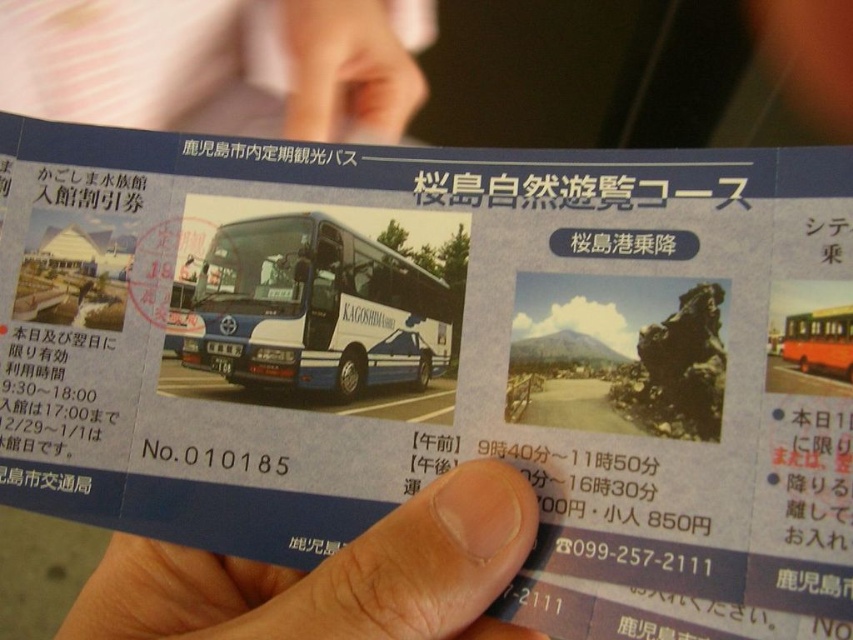
Question: Does blue glossy bus at center appear on the right side of orange matte bus at center?

Choices:
 (A) yes
 (B) no

Answer: (B)

Question: Which of the following is the farthest from the observer?

Choices:
 (A) skinny white hand at upper center
 (B) orange matte bus at center
 (C) flesh-toned skin at lower center

Answer: (A)

Question: Can you confirm if skinny white hand at upper center is smaller than orange matte bus at center?

Choices:
 (A) no
 (B) yes

Answer: (A)

Question: Which of the following is the farthest from the observer?

Choices:
 (A) (354, 611)
 (B) (827, 348)
 (C) (403, 100)
 (D) (264, 234)

Answer: (C)

Question: Is blue glossy bus at center behind orange matte bus at center?

Choices:
 (A) yes
 (B) no

Answer: (A)

Question: Among these points, which one is farthest from the camera?

Choices:
 (A) (433, 550)
 (B) (433, 38)
 (C) (795, 317)
 (D) (177, 310)

Answer: (B)